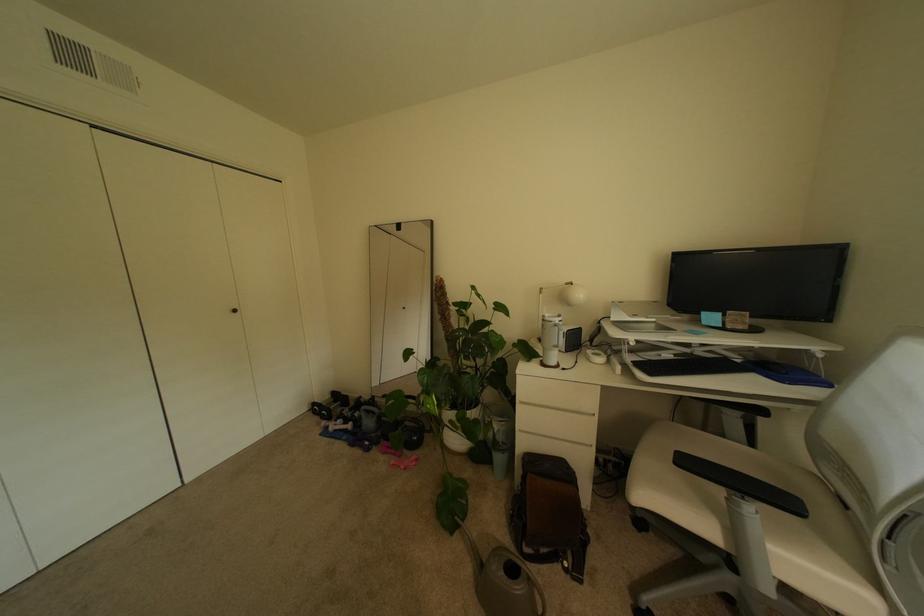
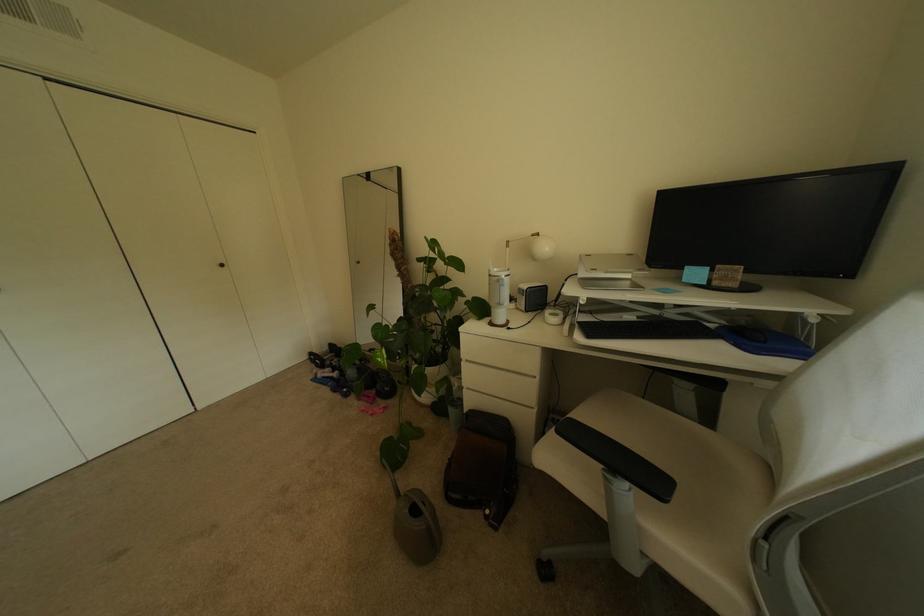
Locate, in the second image, the point that corresponds to (x=552, y=367) in the first image.

(500, 325)